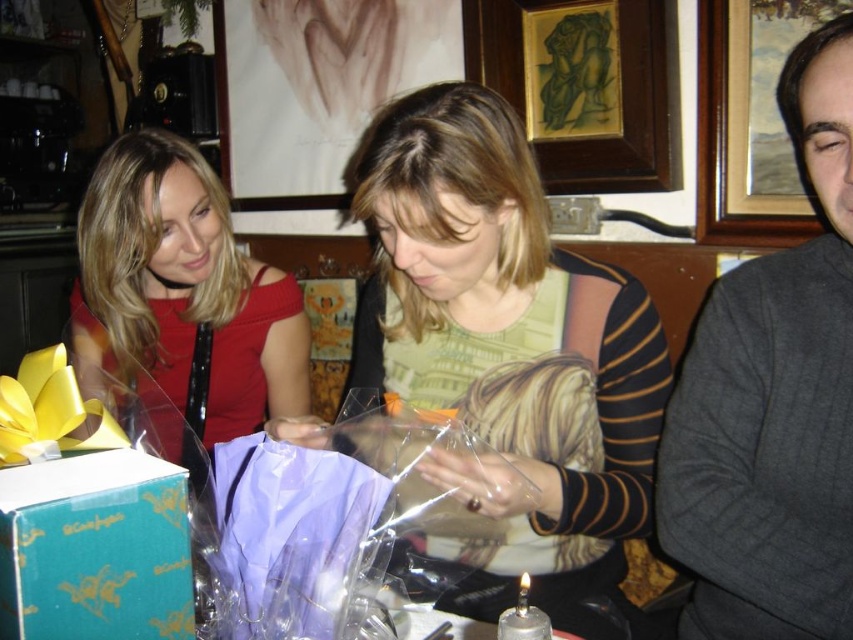
You are a photographer trying to capture a closeup shot of the wooden picture frame at upper right without including the matte green sweater at center in the frame. Given their relative sizes, is this possible?

The matte green sweater at center is much taller than the wooden picture frame at upper right, so it might be challenging to exclude the sweater from the photo if they are positioned close to each other. Adjust your angle or move closer to the wooden picture frame at upper right to ensure only it is in the frame.

You are helping organize a charity clothing drive and need to determine which items can fit into a donation box that requires garments to be no larger than the matte red dress at left. Based on the scene, can the matte green sweater at center be placed in the box?

The matte green sweater at center has a larger size compared to the matte red dress at left. Since the donation box requires garments no larger than the matte red dress at left, the matte green sweater at center cannot be placed in the box.